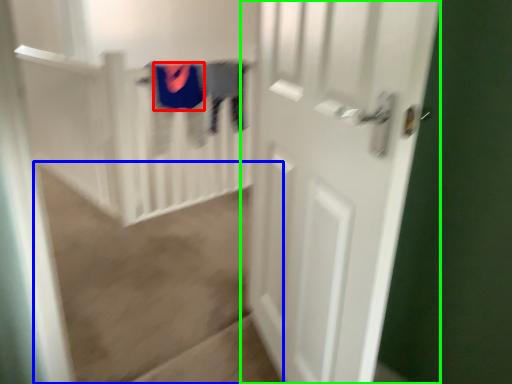
Question: Estimate the real-world distances between objects in this image. Which object is closer to clothing (highlighted by a red box), plain (highlighted by a blue box) or door (highlighted by a green box)?

Choices:
 (A) plain
 (B) door

Answer: (A)